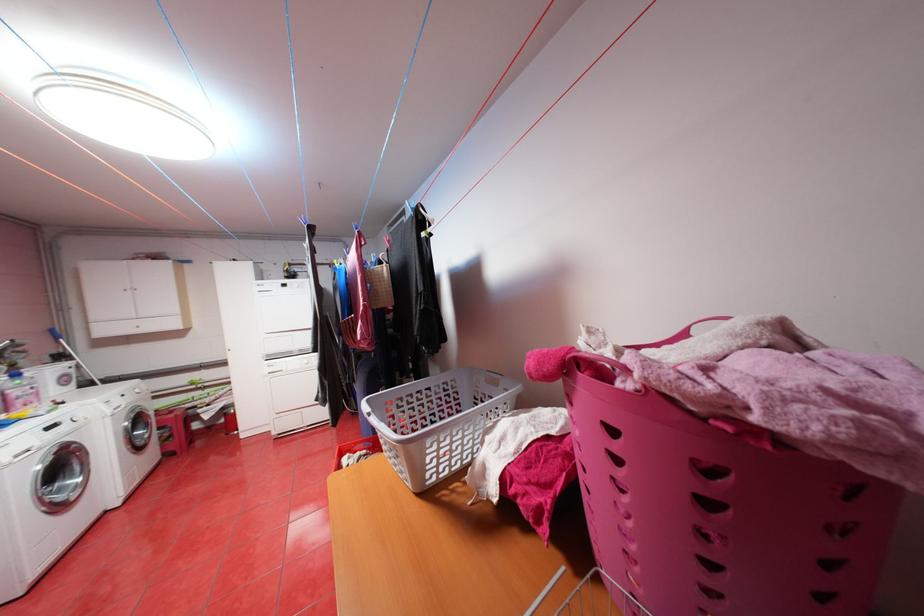
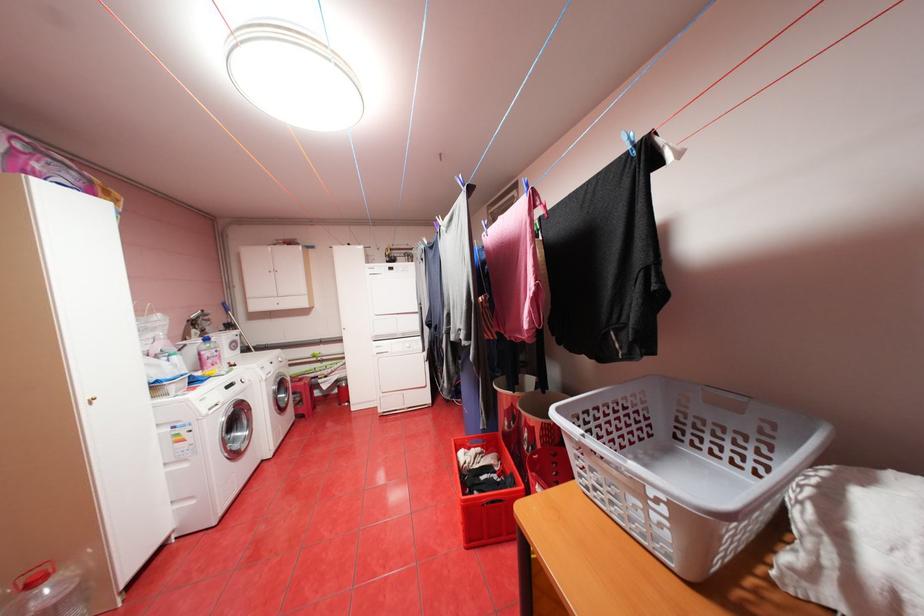
Where in the second image is the point corresponding to the point at 179,411 from the first image?

(310, 379)